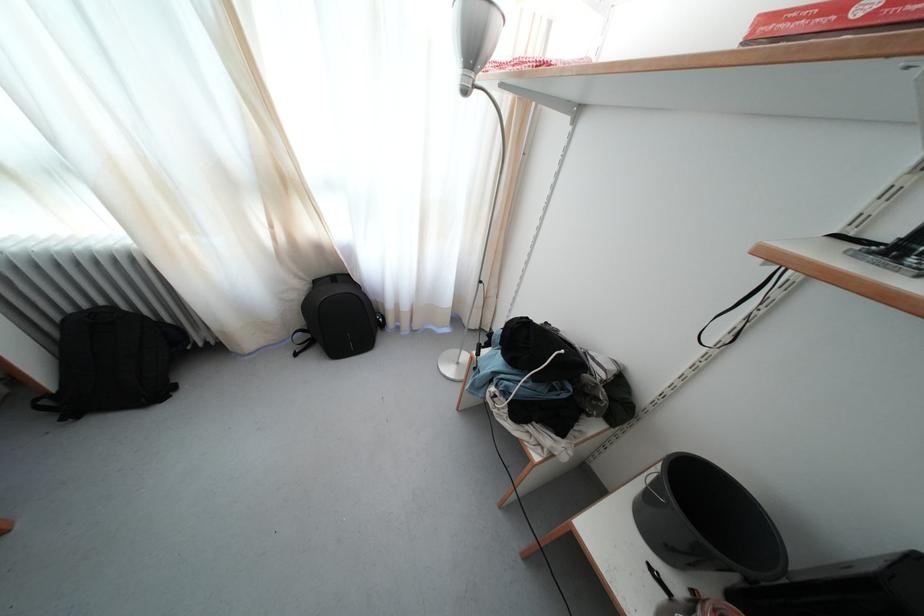
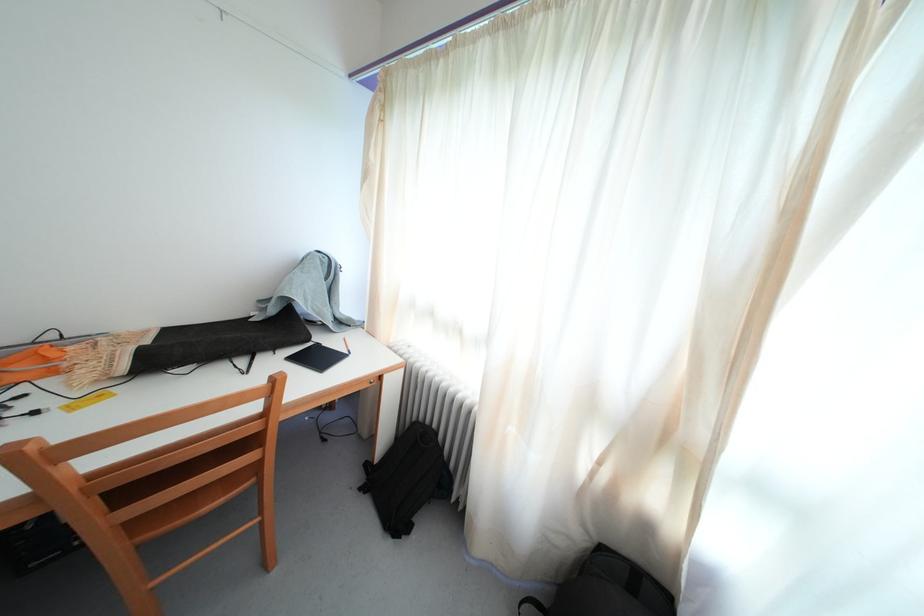
Question: The first image is from the beginning of the video and the second image is from the end. How did the camera likely rotate when shooting the video?

Choices:
 (A) Left
 (B) Right
 (C) Up
 (D) Down

Answer: (A)